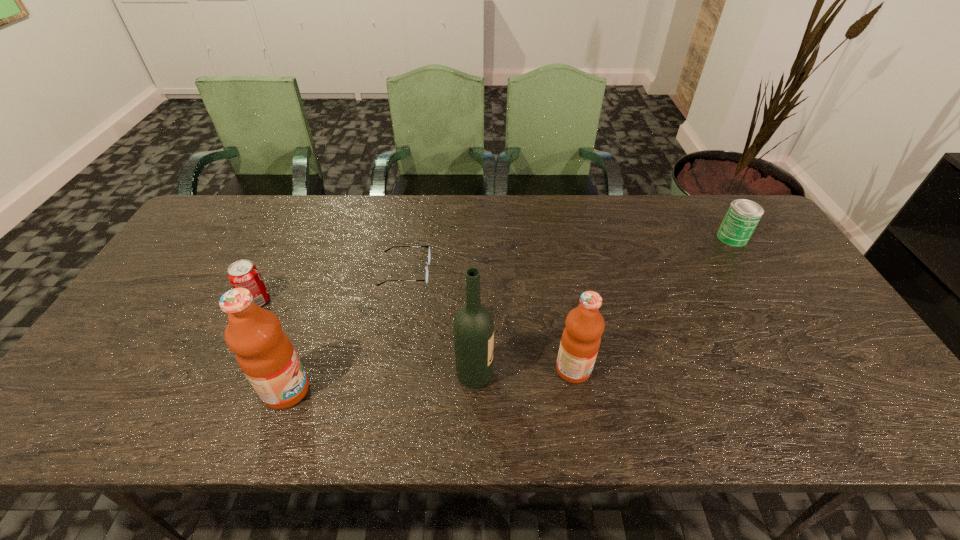
Image resolution: width=960 pixels, height=540 pixels. I want to click on free point between the fourth object from right to left and the farthest object, so click(x=569, y=254).

Locate an element on the screen. This screenshot has height=540, width=960. free area in between the third object from right to left and the second object from right to left is located at coordinates (524, 372).

Locate an element on the screen. free point between the shortest object and the left fruit juice is located at coordinates (346, 331).

Find the location of a particular element. The image size is (960, 540). free spot between the wine bottle and the right fruit juice is located at coordinates (524, 372).

I want to click on vacant area that lies between the fourth shortest object and the soda, so click(416, 335).

Identify which object is located as the nearest to the fifth object from right to left. Please provide its 2D coordinates. Your answer should be formatted as a tuple, i.e. [(x, y)], where the tuple contains the x and y coordinates of a point satisfying the conditions above.

[(243, 273)]

At what (x,y) coordinates should I click in order to perform the action: click on object that is the second nearest to the shortest object. Please return your answer as a coordinate pair (x, y). This screenshot has height=540, width=960. Looking at the image, I should click on tap(243, 273).